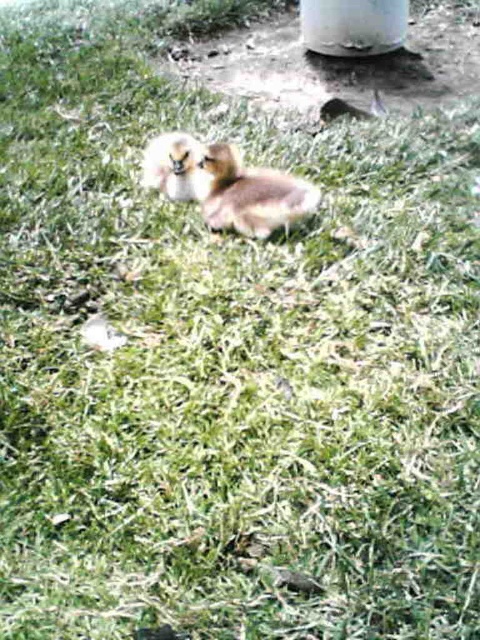
Who is higher up, brown fuzzy duckling at center or fluffy brown duckling at center?

fluffy brown duckling at center is above.

Is point (304, 180) positioned before point (168, 132)?

Yes.

The height and width of the screenshot is (640, 480). I want to click on brown fuzzy duckling at center, so click(x=249, y=195).

This screenshot has width=480, height=640. Identify the location of brown fuzzy duckling at center. (249, 195).

Measure the distance between brown fuzzy duckling at center and camera.

The distance of brown fuzzy duckling at center from camera is 8.03 feet.

Consider the image. Who is positioned more to the left, brown fuzzy duckling at center or white glossy pillar at upper center?

brown fuzzy duckling at center

What do you see at coordinates (249, 195) in the screenshot? The height and width of the screenshot is (640, 480). I see `brown fuzzy duckling at center` at bounding box center [249, 195].

Find the location of a particular element. This screenshot has width=480, height=640. brown fuzzy duckling at center is located at coordinates (249, 195).

Who is more distant from viewer, (334, 42) or (156, 148)?

Point (334, 42)

Which is in front, point (348, 32) or point (143, 160)?

Point (143, 160) is in front.

Which is behind, point (373, 20) or point (148, 179)?

Point (373, 20)

Image resolution: width=480 pixels, height=640 pixels. What are the coordinates of `white glossy pillar at upper center` in the screenshot? It's located at point(352,26).